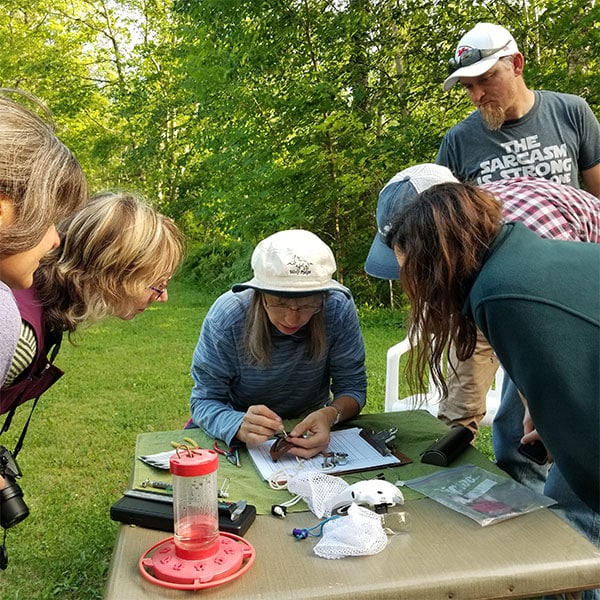
This screenshot has height=600, width=600. What are the coordinates of `plastic chair` in the screenshot? It's located at (392, 399).